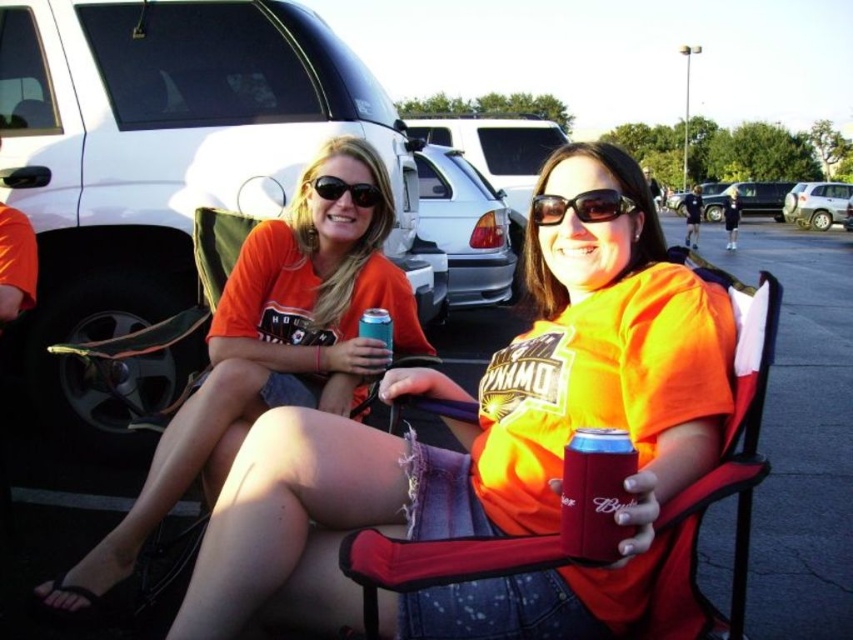
In the scene shown: Who is positioned more to the right, orange cotton shirt at center or orange fabric shirt at center?

orange cotton shirt at center is more to the right.

Is point (547, 401) farther from camera compared to point (361, 384)?

No, (547, 401) is closer to viewer.

Is point (618, 593) less distant than point (268, 248)?

Yes, point (618, 593) is closer to viewer.

At what (x,y) coordinates should I click in order to perform the action: click on orange cotton shirt at center. Please return your answer as a coordinate pair (x, y). Looking at the image, I should click on (492, 449).

Who is higher up, white matte truck at upper left or white matte sedan at center?

white matte sedan at center

Can you confirm if white matte truck at upper left is positioned below white matte sedan at center?

Indeed, white matte truck at upper left is positioned under white matte sedan at center.

What are the coordinates of `white matte truck at upper left` in the screenshot? It's located at [x=166, y=163].

Is metallic silver suv at center in front of matte black sunglasses at center?

That is False.

Does point (711, 208) lie behind point (368, 205)?

Yes, point (711, 208) is behind point (368, 205).

Where is `metallic silver suv at center`? This screenshot has height=640, width=853. metallic silver suv at center is located at coordinates (782, 202).